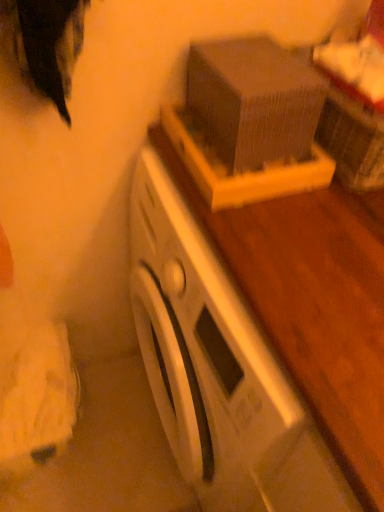
Measure the distance between wooden box at upper center and camera.

wooden box at upper center is 25.21 inches away from camera.

In order to click on wooden box at upper center in this screenshot , I will do `click(253, 101)`.

What is the approximate height of wooden box at upper center?

wooden box at upper center is 3.56 inches in height.

In order to face wooden box at upper center, should I rotate leftwards or rightwards?

To face it directly, rotate right by 5.999 degrees.

This screenshot has width=384, height=512. Describe the element at coordinates (253, 101) in the screenshot. I see `wooden box at upper center` at that location.

Where is `white matte washing machine at center`? Image resolution: width=384 pixels, height=512 pixels. white matte washing machine at center is located at coordinates [x=218, y=369].

This screenshot has width=384, height=512. What do you see at coordinates (218, 369) in the screenshot? I see `white matte washing machine at center` at bounding box center [218, 369].

This screenshot has width=384, height=512. Find the location of `wooden box at upper center`. wooden box at upper center is located at coordinates (253, 101).

Which is more to the left, wooden box at upper center or white matte washing machine at center?

From the viewer's perspective, wooden box at upper center appears more on the left side.

Which object is more forward, wooden box at upper center or white matte washing machine at center?

white matte washing machine at center is in front.

Considering the points (309, 85) and (220, 506), which point is in front, point (309, 85) or point (220, 506)?

The point (309, 85) is more forward.

Looking at this image, from the image's perspective, is wooden box at upper center on white matte washing machine at center?

Indeed, from the image's perspective, wooden box at upper center is shown above white matte washing machine at center.

From a real-world perspective, is wooden box at upper center on top of white matte washing machine at center?

Answer: Yes, from a real-world perspective, wooden box at upper center is over white matte washing machine at center

Can you confirm if wooden box at upper center is wider than white matte washing machine at center?

Incorrect, the width of wooden box at upper center does not surpass that of white matte washing machine at center.

Which of these two, wooden box at upper center or white matte washing machine at center, stands taller?

With more height is white matte washing machine at center.

Who is smaller, wooden box at upper center or white matte washing machine at center?

With smaller size is wooden box at upper center.

Is wooden box at upper center positioned beyond the bounds of white matte washing machine at center?

wooden box at upper center lies outside white matte washing machine at center's area.

Based on the photo, is wooden box at upper center far from white matte washing machine at center?

They are positioned close to each other.

Could you tell me if wooden box at upper center is turned towards white matte washing machine at center?

No, wooden box at upper center is not facing towards white matte washing machine at center.

How different are the orientations of wooden box at upper center and white matte washing machine at center in degrees?

wooden box at upper center and white matte washing machine at center are facing 0.357 degrees away from each other.

Locate an element on the screen. The image size is (384, 512). box above the white matte washing machine at center (from the image's perspective) is located at coordinates (253, 101).

Based on their positions, is white matte washing machine at center located to the left or right of wooden box at upper center?

Based on their positions, white matte washing machine at center is located to the right of wooden box at upper center.

Which object is more forward, white matte washing machine at center or wooden box at upper center?

white matte washing machine at center is closer to the camera.

Does point (165, 422) lie behind point (250, 146)?

Yes, it is behind point (250, 146).

From the image's perspective, which one is positioned lower, white matte washing machine at center or wooden box at upper center?

white matte washing machine at center, from the image's perspective.

From a real-world perspective, is white matte washing machine at center beneath wooden box at upper center?

Correct, in the physical world, white matte washing machine at center is lower than wooden box at upper center.

Considering the sizes of objects white matte washing machine at center and wooden box at upper center in the image provided, who is thinner, white matte washing machine at center or wooden box at upper center?

With smaller width is wooden box at upper center.

Looking at this image, considering the sizes of white matte washing machine at center and wooden box at upper center in the image, is white matte washing machine at center taller or shorter than wooden box at upper center?

Considering their sizes, white matte washing machine at center has more height than wooden box at upper center.

Looking at this image, is white matte washing machine at center bigger than wooden box at upper center?

Yes, white matte washing machine at center is bigger than wooden box at upper center.

Can we say white matte washing machine at center lies outside wooden box at upper center?

Yes, white matte washing machine at center is located beyond the bounds of wooden box at upper center.

Is white matte washing machine at center not near wooden box at upper center?

No, white matte washing machine at center is not far from wooden box at upper center.

Based on the photo, could you tell me if white matte washing machine at center is turned towards wooden box at upper center?

No, white matte washing machine at center does not turn towards wooden box at upper center.

How many degrees apart are the facing directions of white matte washing machine at center and wooden box at upper center?

0.357 degrees.

Where is `box located above the white matte washing machine at center (from a real-world perspective)`? The image size is (384, 512). box located above the white matte washing machine at center (from a real-world perspective) is located at coordinates (253, 101).

The image size is (384, 512). I want to click on washing machine that is under the wooden box at upper center (from a real-world perspective), so click(218, 369).

Locate an element on the screen. The image size is (384, 512). box on the left of white matte washing machine at center is located at coordinates (253, 101).